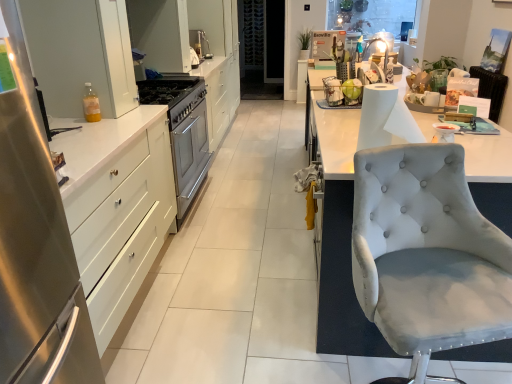
Question: From the image's perspective, is satin silver sink at center located above or below light gray fabric chair at right?

Choices:
 (A) below
 (B) above

Answer: (B)

Question: In terms of width, does satin silver sink at center look wider or thinner when compared to light gray fabric chair at right?

Choices:
 (A) wide
 (B) thin

Answer: (B)

Question: Estimate the real-world distances between objects in this image. Which object is closer to the white glossy cabinet at upper left, which is the 3th cabinetry from bottom to top?

Choices:
 (A) light gray fabric chair at right
 (B) satin silver sink at center
 (C) white glossy cabinet at upper left, the second cabinetry in the back-to-front sequence
 (D) white paper at right
 (E) satin silver gas stove at center

Answer: (E)

Question: Estimate the real-world distances between objects in this image. Which object is closer to the satin silver gas stove at center?

Choices:
 (A) satin silver sink at center
 (B) white paper at right
 (C) white glossy cabinet at upper left, the second cabinetry in the back-to-front sequence
 (D) light gray fabric chair at right
 (E) satin white drawers at left, the first cabinetry positioned from the bottom

Answer: (A)